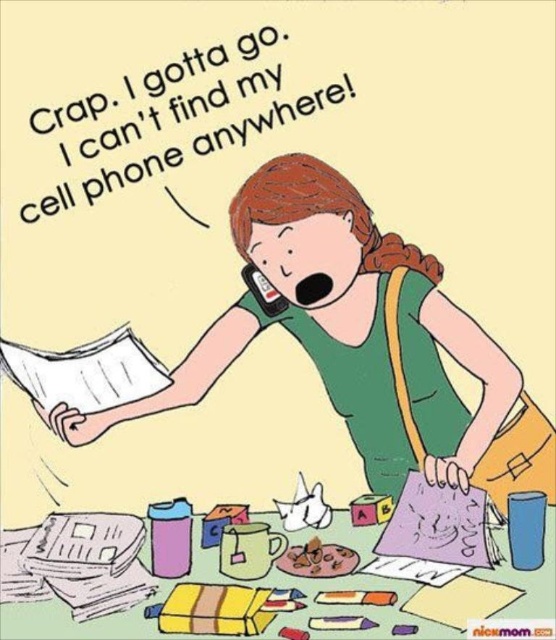
Question: Among these objects, which one is nearest to the camera?

Choices:
 (A) green fabric shirt at center
 (B) matte black phone at mouth

Answer: (A)

Question: Is green fabric shirt at center positioned in front of matte black phone at mouth?

Choices:
 (A) yes
 (B) no

Answer: (A)

Question: Is green fabric shirt at center to the right of matte black phone at mouth from the viewer's perspective?

Choices:
 (A) no
 (B) yes

Answer: (B)

Question: Is green fabric shirt at center smaller than matte black phone at mouth?

Choices:
 (A) yes
 (B) no

Answer: (B)